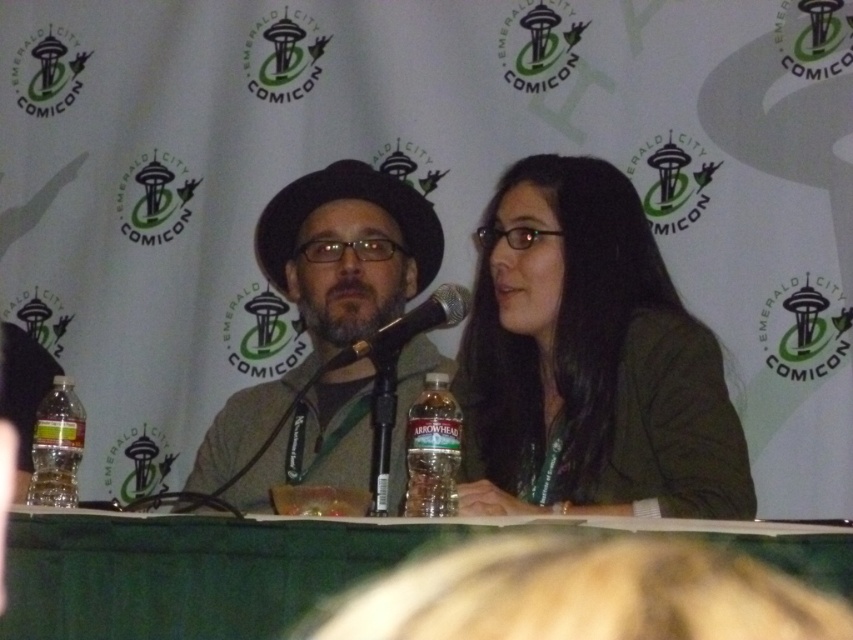
In the scene shown: Is matte brown hat at center taller than black matte microphone at center?

Yes.

Is matte brown hat at center shorter than black matte microphone at center?

No, matte brown hat at center is not shorter than black matte microphone at center.

Between point (409, 224) and point (434, 292), which one is positioned behind?

The point (409, 224) is more distant.

The width and height of the screenshot is (853, 640). Find the location of `matte brown hat at center`. matte brown hat at center is located at coordinates (323, 328).

Between green matte jacket at center and clear plastic bottle at lower left, which one is positioned lower?

clear plastic bottle at lower left is below.

Is green matte jacket at center above clear plastic bottle at lower left?

Yes.

I want to click on green matte jacket at center, so click(589, 360).

Is green matte jacket at center to the left of matte brown hat at center from the viewer's perspective?

In fact, green matte jacket at center is to the right of matte brown hat at center.

What do you see at coordinates (589, 360) in the screenshot? The width and height of the screenshot is (853, 640). I see `green matte jacket at center` at bounding box center [589, 360].

Which is behind, point (656, 268) or point (398, 212)?

Point (398, 212)

Find the location of a particular element. This screenshot has width=853, height=640. green matte jacket at center is located at coordinates (589, 360).